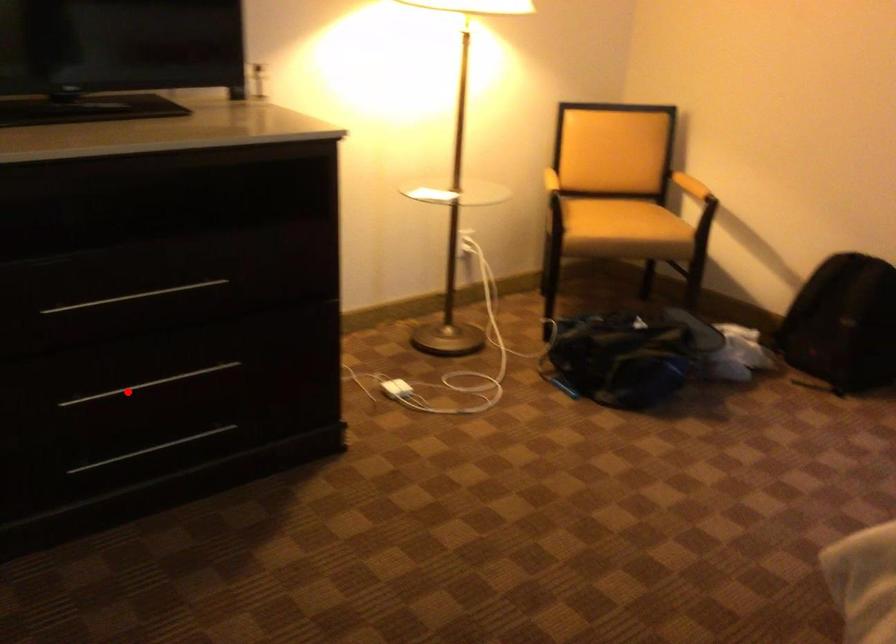
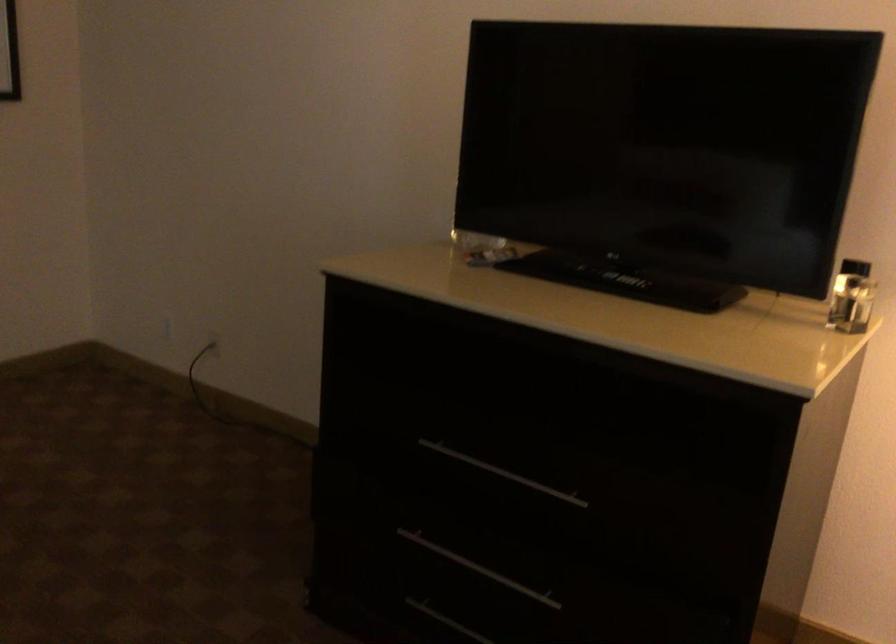
Find the pixel in the second image that matches the highlighted location in the first image.

(478, 567)